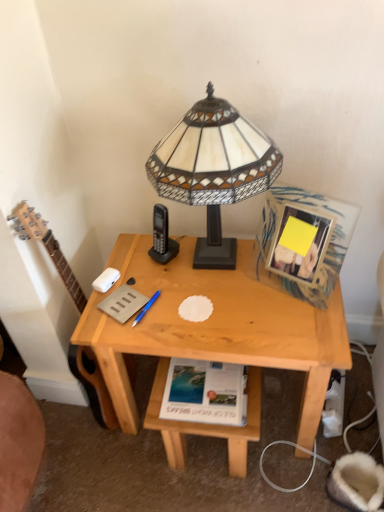
Question: Considering the relative sizes of wooden picture frame at upper right and stained glass lampshade at center in the image provided, is wooden picture frame at upper right wider than stained glass lampshade at center?

Choices:
 (A) no
 (B) yes

Answer: (A)

Question: From a real-world perspective, is wooden picture frame at upper right beneath stained glass lampshade at center?

Choices:
 (A) no
 (B) yes

Answer: (B)

Question: Is the depth of wooden picture frame at upper right greater than that of stained glass lampshade at center?

Choices:
 (A) no
 (B) yes

Answer: (B)

Question: Is wooden picture frame at upper right oriented towards stained glass lampshade at center?

Choices:
 (A) yes
 (B) no

Answer: (B)

Question: Is wooden picture frame at upper right positioned in front of stained glass lampshade at center?

Choices:
 (A) no
 (B) yes

Answer: (A)

Question: Can you confirm if wooden picture frame at upper right is positioned to the right of stained glass lampshade at center?

Choices:
 (A) no
 (B) yes

Answer: (B)

Question: From a real-world perspective, does light wood desk at center stand above white paper at lower center, the first paperback book in the right-to-left sequence?

Choices:
 (A) no
 (B) yes

Answer: (A)

Question: Does light wood desk at center have a lesser height compared to white paper at lower center, the first paperback book in the right-to-left sequence?

Choices:
 (A) yes
 (B) no

Answer: (B)

Question: Would you say light wood desk at center contains white paper at lower center, marked as the 2th paperback book in a top-to-bottom arrangement?

Choices:
 (A) no
 (B) yes

Answer: (B)

Question: Considering the relative sizes of light wood desk at center and white paper at lower center, the first paperback book in the right-to-left sequence, in the image provided, is light wood desk at center taller than white paper at lower center, the first paperback book in the right-to-left sequence,?

Choices:
 (A) yes
 (B) no

Answer: (A)

Question: Does light wood desk at center have a greater width compared to white paper at lower center, the first paperback book positioned from the bottom?

Choices:
 (A) yes
 (B) no

Answer: (A)

Question: Is the depth of light wood desk at center greater than that of white paper at lower center, the first paperback book positioned from the bottom?

Choices:
 (A) yes
 (B) no

Answer: (B)

Question: Is white paper at lower center, the first paperback book in the right-to-left sequence, located outside wooden picture frame at upper right?

Choices:
 (A) yes
 (B) no

Answer: (A)